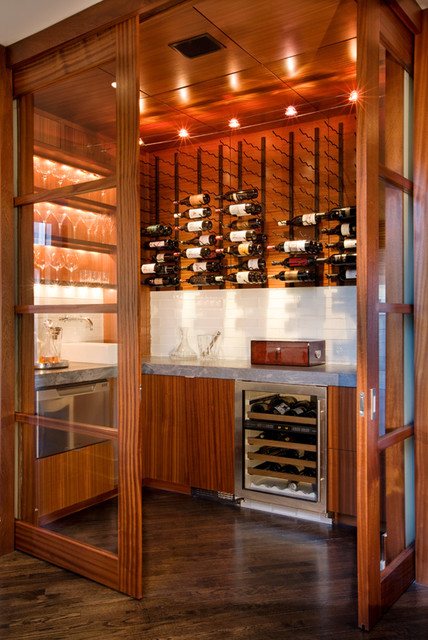
In order to click on glass part of door in this screenshot , I will do `click(91, 497)`.